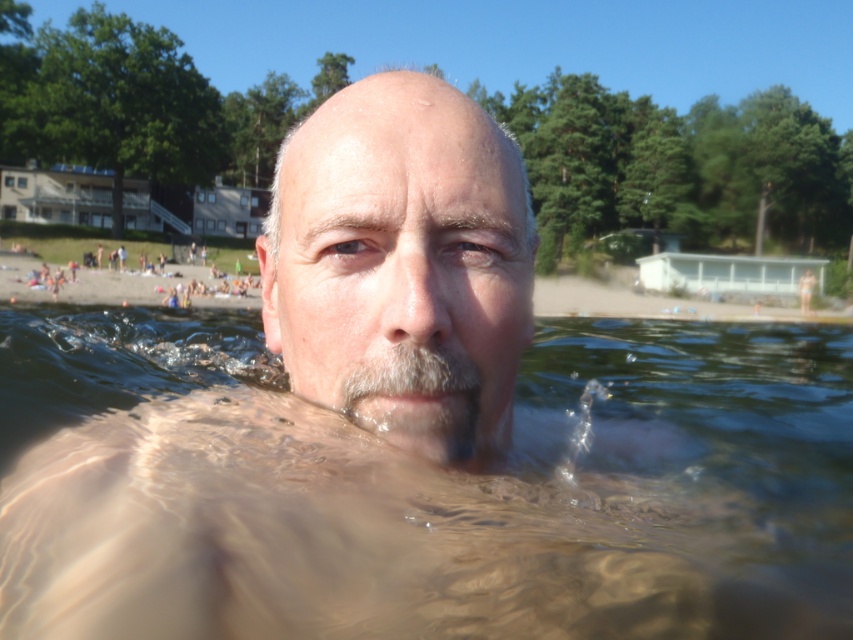
Question: Among these objects, which one is farthest from the camera?

Choices:
 (A) smooth skin nose at center
 (B) smooth skin face at center

Answer: (B)

Question: Which object appears farthest from the camera in this image?

Choices:
 (A) smooth skin nose at center
 (B) clear water at center
 (C) gray matte beard at center

Answer: (C)

Question: Is clear water at center bigger than gray matte beard at center?

Choices:
 (A) no
 (B) yes

Answer: (B)

Question: Which point appears farthest from the camera in this image?

Choices:
 (A) (735, 372)
 (B) (376, 419)

Answer: (A)

Question: Is gray matte beard at center below smooth skin nose at center?

Choices:
 (A) yes
 (B) no

Answer: (A)

Question: Does clear water at center have a smaller size compared to smooth skin face at center?

Choices:
 (A) no
 (B) yes

Answer: (A)